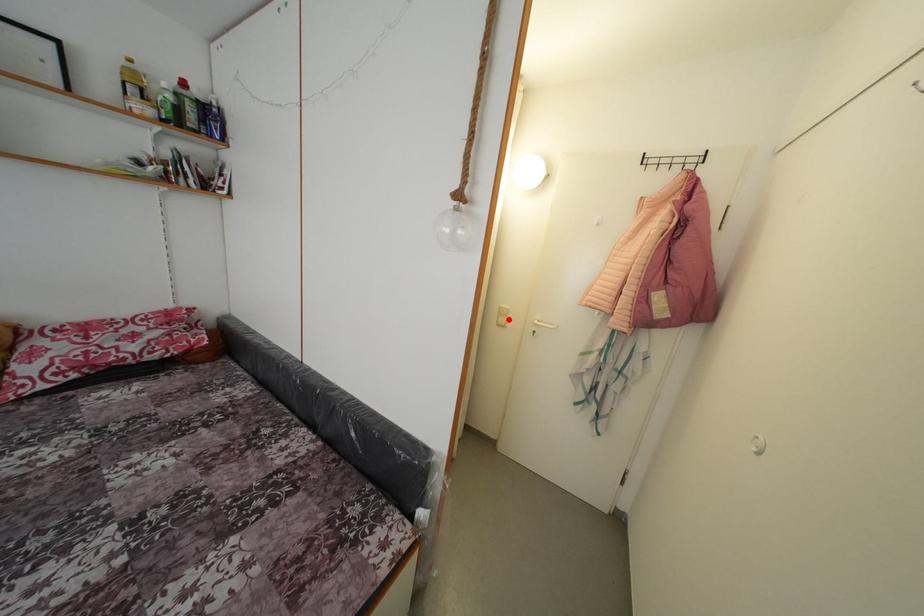
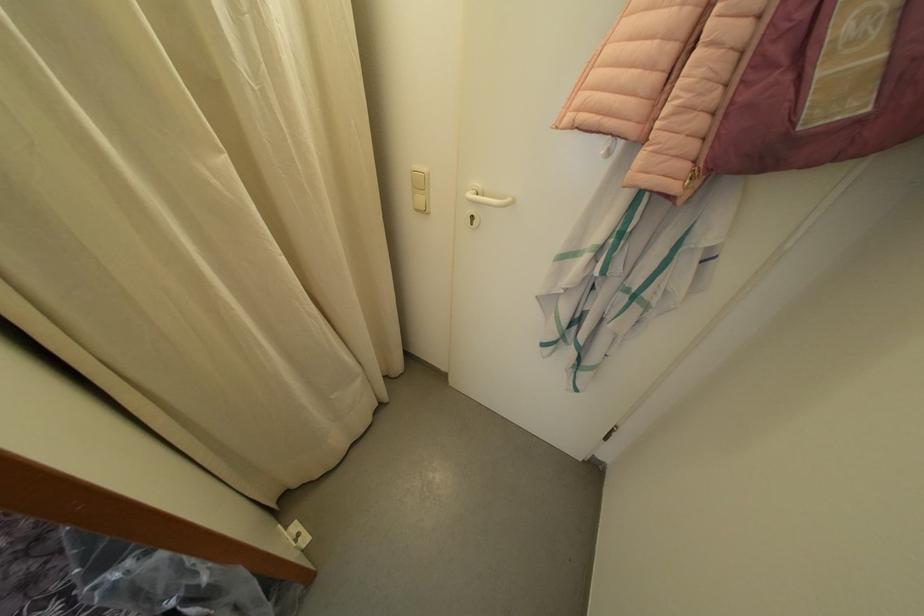
Locate, in the second image, the point that corresponds to the highlighted location in the first image.

(427, 191)